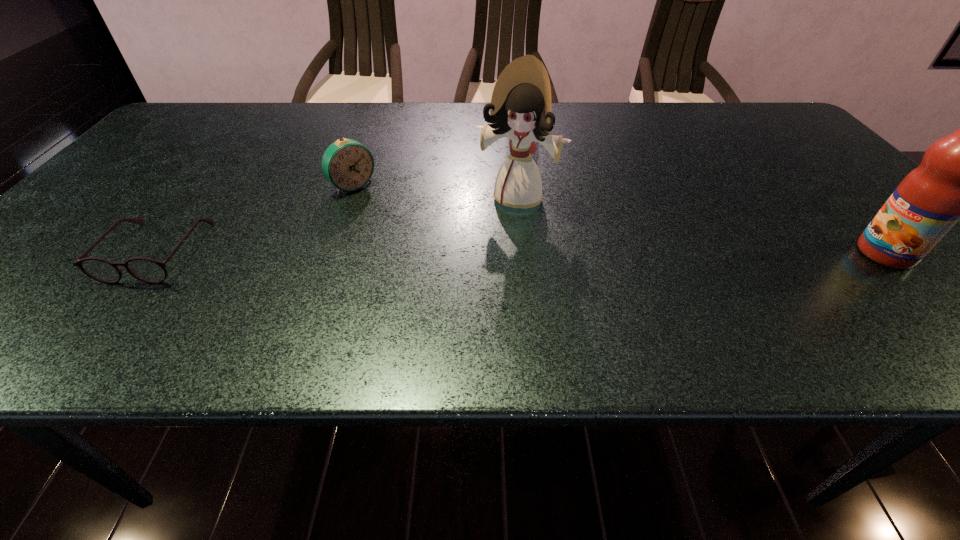
In the image, there is a desktop. In order to click on vacant space at the near edge in this screenshot , I will do [x=519, y=279].

In the image, there is a desktop. What are the coordinates of `free space at the left edge` in the screenshot? It's located at (121, 207).

I want to click on vacant point located between the rightmost object and the third tallest object, so click(619, 220).

What are the coordinates of `vacant region between the leftmost object and the rightmost object` in the screenshot? It's located at (521, 252).

The image size is (960, 540). I want to click on vacant area between the third object from left to right and the second object from left to right, so pyautogui.click(x=436, y=192).

Identify the location of object identified as the closest to the third object from left to right. (347, 164).

Locate which object is the closest to the leftmost object. Please provide its 2D coordinates. Your answer should be formatted as a tuple, i.e. [(x, y)], where the tuple contains the x and y coordinates of a point satisfying the conditions above.

[(347, 164)]

In order to click on free space in the image that satisfies the following two spatial constraints: 1. on the front-facing side of the spectacles; 2. on the front label of the fruit juice in this screenshot , I will do `click(156, 253)`.

I want to click on vacant space that satisfies the following two spatial constraints: 1. on the front-facing side of the shortest object; 2. on the front label of the rightmost object, so click(156, 253).